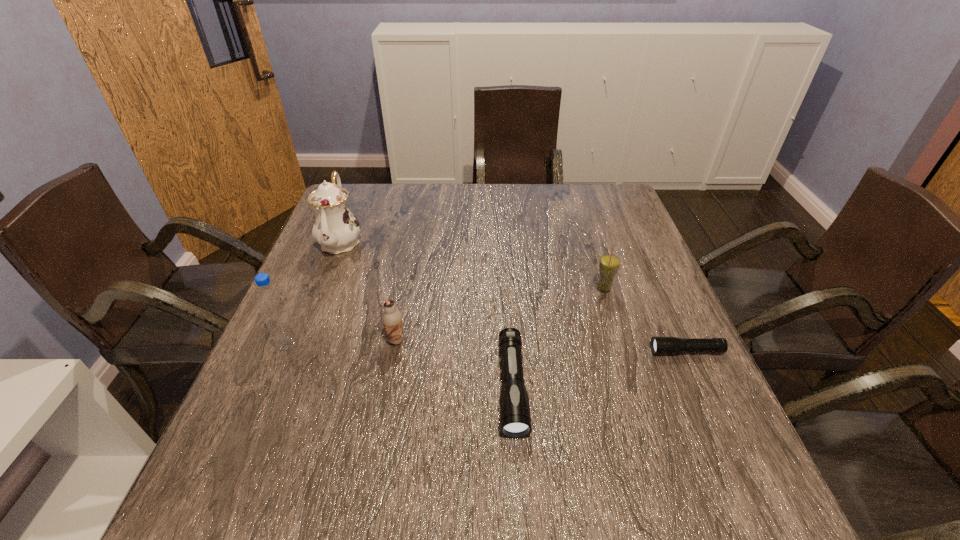
Identify which object is the third closest to the water bottle. Please provide its 2D coordinates. Your answer should be formatted as a tuple, i.e. [(x, y)], where the tuple contains the x and y coordinates of a point satisfying the conditions above.

[(515, 419)]

Identify which object is the third closest to the fourth object from left to right. Please provide its 2D coordinates. Your answer should be formatted as a tuple, i.e. [(x, y)], where the tuple contains the x and y coordinates of a point satisfying the conditions above.

[(659, 345)]

The width and height of the screenshot is (960, 540). Identify the location of free space in the image that satisfies the following two spatial constraints: 1. at the lens end of the rightmost object; 2. at the lens end of the taller flashlight. (702, 387).